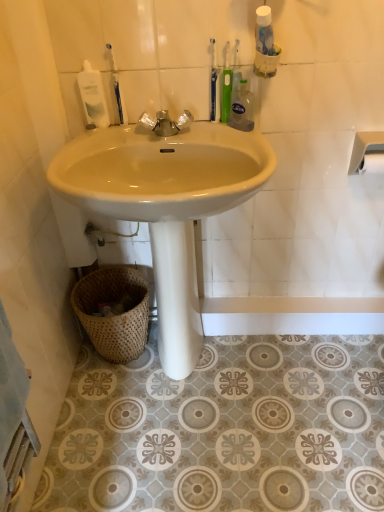
The width and height of the screenshot is (384, 512). Find the location of `vacant space in front of green plastic toothbrush at upper center, positioned as the 2th toothbrush in right-to-left order`. vacant space in front of green plastic toothbrush at upper center, positioned as the 2th toothbrush in right-to-left order is located at coordinates (233, 137).